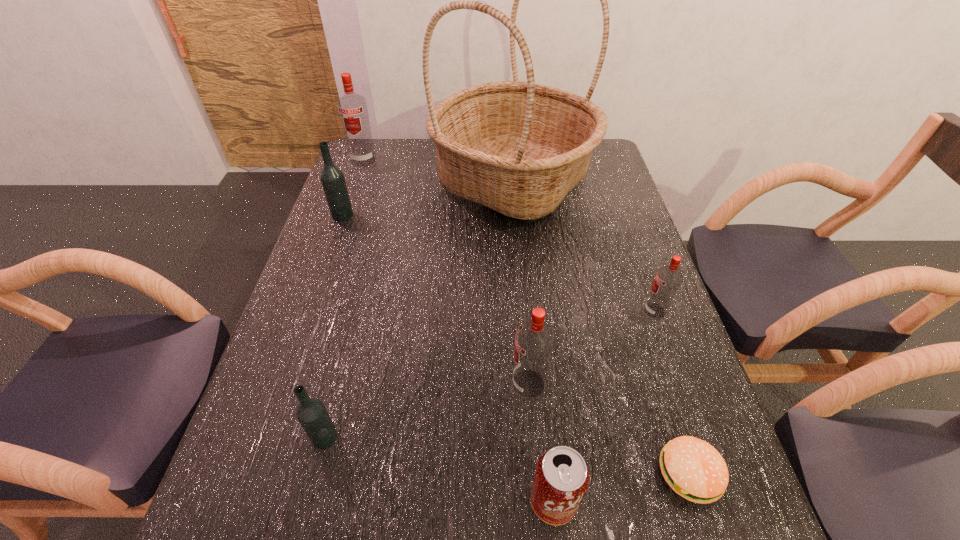
The image size is (960, 540). Find the location of `free point between the smallest red vodka and the left black vodka`. free point between the smallest red vodka and the left black vodka is located at coordinates (498, 263).

Locate an element on the screen. This screenshot has height=540, width=960. free space between the third nearest vodka and the nearest vodka is located at coordinates (490, 374).

Where is `free spot between the second tallest object and the third vodka from left to right`? free spot between the second tallest object and the third vodka from left to right is located at coordinates (345, 299).

Find the location of a particular element. This screenshot has width=960, height=540. free space between the tallest object and the patty is located at coordinates (601, 327).

Locate an element on the screen. The height and width of the screenshot is (540, 960). vacant area between the bigger black vodka and the soda can is located at coordinates (448, 358).

Locate an element on the screen. The image size is (960, 540). blank region between the basket and the second nearest red vodka is located at coordinates (584, 246).

Locate an element on the screen. This screenshot has width=960, height=540. vacant area that lies between the basket and the smallest red vodka is located at coordinates (584, 246).

At what (x,y) coordinates should I click in order to perform the action: click on free space between the smallest red vodka and the second tallest object. Please return your answer as a coordinate pair (x, y). The image size is (960, 540). Looking at the image, I should click on (509, 235).

I want to click on vacant area that lies between the farthest red vodka and the bigger black vodka, so click(x=353, y=187).

I want to click on object that stands as the fourth closest to the bigger black vodka, so click(534, 340).